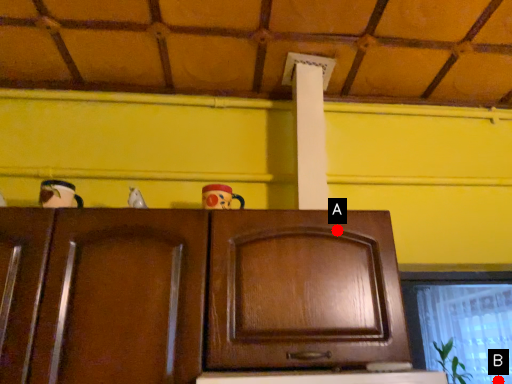
Question: Two points are circled on the image, labeled by A and B beside each circle. Which point is closer to the camera taking this photo?

Choices:
 (A) A is closer
 (B) B is closer

Answer: (A)